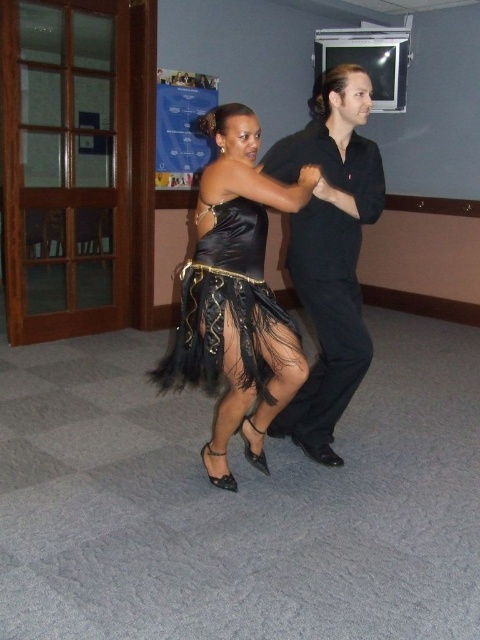
Question: Can you confirm if black satin shirt at center is positioned to the right of satin dress at center?

Choices:
 (A) no
 (B) yes

Answer: (B)

Question: Is black satin shirt at center closer to the viewer compared to satin dress at center?

Choices:
 (A) yes
 (B) no

Answer: (B)

Question: Which object is farther from the camera taking this photo?

Choices:
 (A) satin black dress at center
 (B) satin dress at center
 (C) black satin shirt at center

Answer: (C)

Question: Which object is the farthest from the black satin shirt at center?

Choices:
 (A) satin black dress at center
 (B) satin dress at center

Answer: (B)

Question: Is the position of black satin shirt at center less distant than that of satin dress at center?

Choices:
 (A) yes
 (B) no

Answer: (B)

Question: Which is farther from the satin black dress at center?

Choices:
 (A) black satin shirt at center
 (B) satin dress at center

Answer: (A)